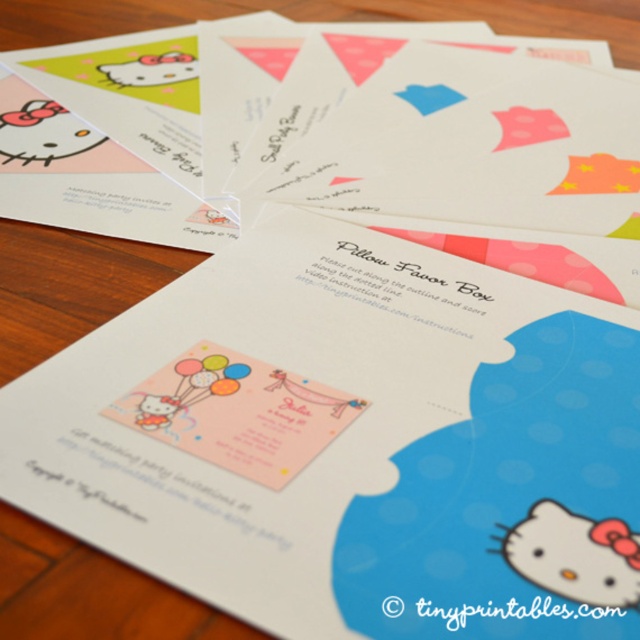
You are organizing a Hello Kitty themed party and need to place the matte paper invitation at center and the matte pink hello kitty at lower right on a table. Based on the scene, which object is closer to you when you look at the table?

The matte paper invitation at center is closer to you because it is in front of the matte pink hello kitty at lower right.

You are organizing a party and need to place the matte pink hello kitty at lower right and the pink paper card at center on a table. Based on the image, which object is closer to you when viewed from the front?

The pink paper card at center is closer because the matte pink hello kitty at lower right is positioned behind it.